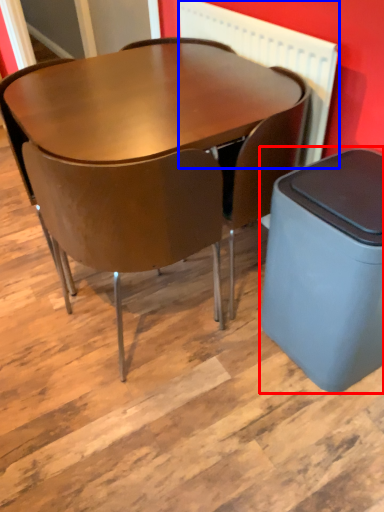
Question: Which of the following is the closest to the observer, waste container (highlighted by a red box) or radiator (highlighted by a blue box)?

Choices:
 (A) waste container
 (B) radiator

Answer: (A)